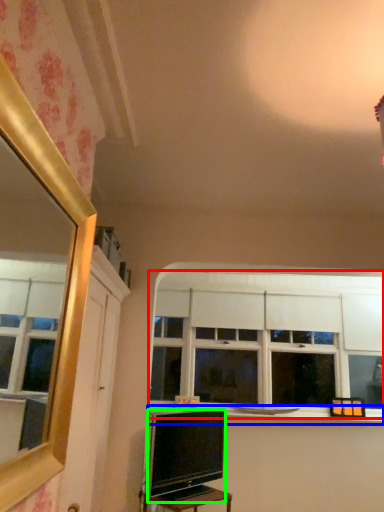
Question: Which is nearer to the window (highlighted by a red box)? window sill (highlighted by a blue box) or television (highlighted by a green box).

Choices:
 (A) window sill
 (B) television

Answer: (A)